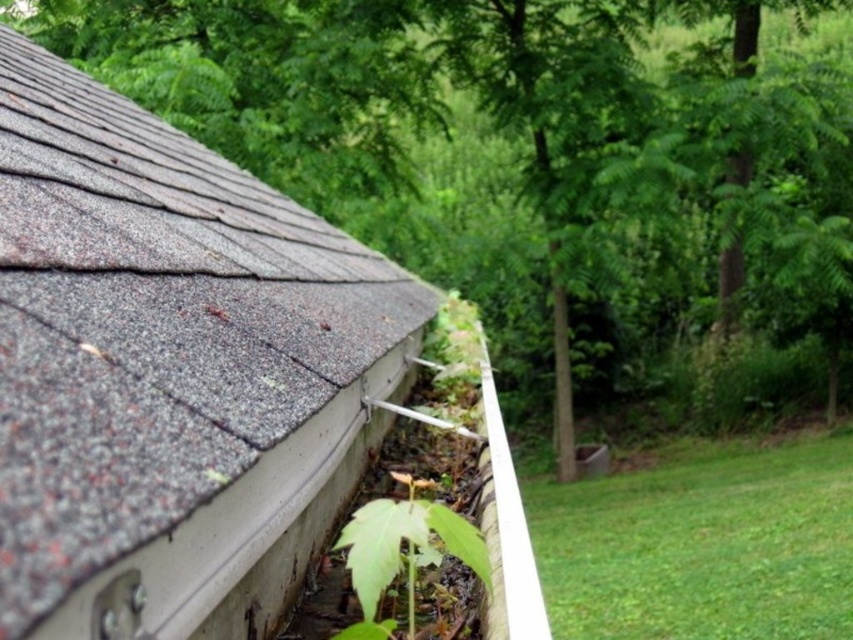
Question: Is gray shingles at upper left positioned in front of green leafy plant at lower center?

Choices:
 (A) yes
 (B) no

Answer: (A)

Question: Which object appears farthest from the camera in this image?

Choices:
 (A) green leafy plant at lower center
 (B) gray shingles at upper left

Answer: (A)

Question: Is gray shingles at upper left to the right of green leafy plant at lower center from the viewer's perspective?

Choices:
 (A) yes
 (B) no

Answer: (B)

Question: Which point is closer to the camera?

Choices:
 (A) (47, 520)
 (B) (444, 534)

Answer: (A)

Question: Can you confirm if gray shingles at upper left is positioned to the left of green leafy plant at lower center?

Choices:
 (A) no
 (B) yes

Answer: (B)

Question: Which point is closer to the camera taking this photo?

Choices:
 (A) (461, 557)
 (B) (253, 564)

Answer: (A)